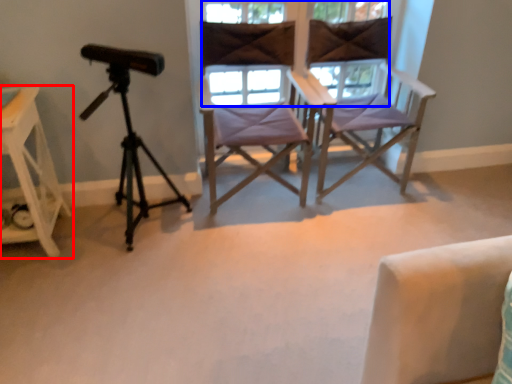
Question: Which object is further to the camera taking this photo, furniture (highlighted by a red box) or window (highlighted by a blue box)?

Choices:
 (A) furniture
 (B) window

Answer: (B)